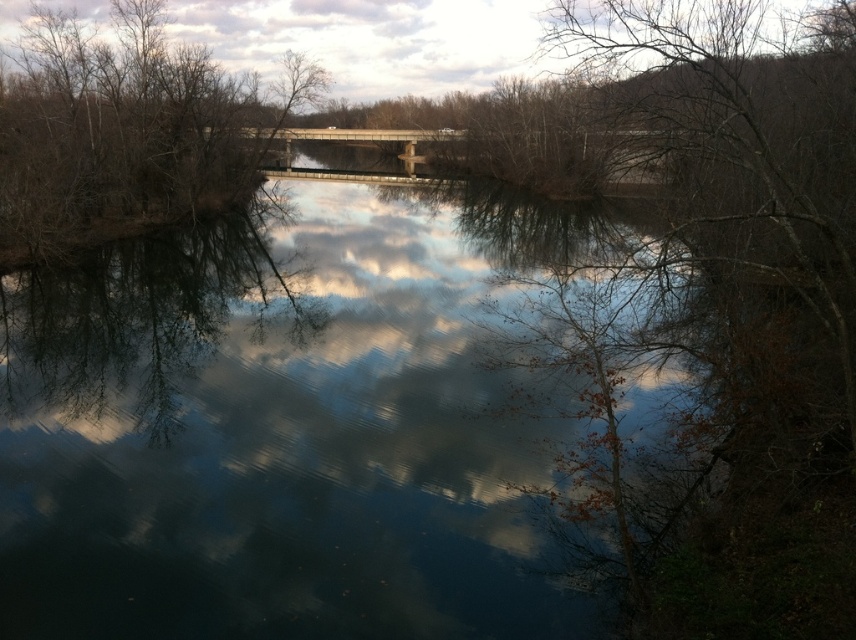
Question: Which object is closer to the camera taking this photo?

Choices:
 (A) transparent water at center
 (B) brown/dry wood tree at upper center

Answer: (A)

Question: Does brown/dry wood tree at upper center have a lesser width compared to concrete bridge at center?

Choices:
 (A) no
 (B) yes

Answer: (B)

Question: Among these points, which one is nearest to the camera?

Choices:
 (A) (317, 131)
 (B) (342, 394)
 (C) (56, 64)

Answer: (B)

Question: Considering the relative positions of transparent water at center and brown/dry wood tree at upper center in the image provided, where is transparent water at center located with respect to brown/dry wood tree at upper center?

Choices:
 (A) below
 (B) above

Answer: (A)

Question: Which point is farther to the camera?

Choices:
 (A) transparent water at center
 (B) concrete bridge at center

Answer: (B)

Question: Is transparent water at center smaller than concrete bridge at center?

Choices:
 (A) no
 (B) yes

Answer: (B)